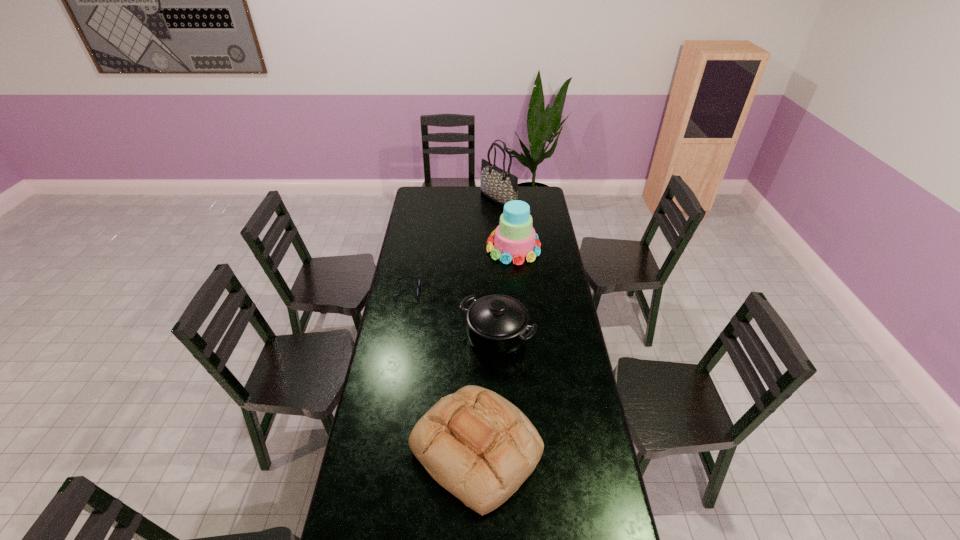
Where is `vacant space in between the tallest object and the second nearest object`? The height and width of the screenshot is (540, 960). vacant space in between the tallest object and the second nearest object is located at coordinates (497, 268).

Where is `vacant space that's between the leftmost object and the nearest object`? The height and width of the screenshot is (540, 960). vacant space that's between the leftmost object and the nearest object is located at coordinates (442, 370).

Where is `free space between the leftmost object and the nearest object`? The height and width of the screenshot is (540, 960). free space between the leftmost object and the nearest object is located at coordinates (442, 370).

Locate an element on the screen. object that is the third closest to the fourth farthest object is located at coordinates tap(514, 239).

Find the location of `the fourth closest object to the bread`. the fourth closest object to the bread is located at coordinates (500, 186).

Where is `free space that satisfies the following two spatial constraints: 1. on the front-facing side of the second nearest object; 2. on the right side of the shortest object`? free space that satisfies the following two spatial constraints: 1. on the front-facing side of the second nearest object; 2. on the right side of the shortest object is located at coordinates (398, 338).

This screenshot has width=960, height=540. What are the coordinates of `free space that satisfies the following two spatial constraints: 1. on the front side of the cake; 2. on the front-facing side of the shortest object` in the screenshot? It's located at (517, 291).

This screenshot has width=960, height=540. I want to click on vacant point that satisfies the following two spatial constraints: 1. on the front-facing side of the spectacles; 2. on the left side of the saucepan, so click(x=398, y=338).